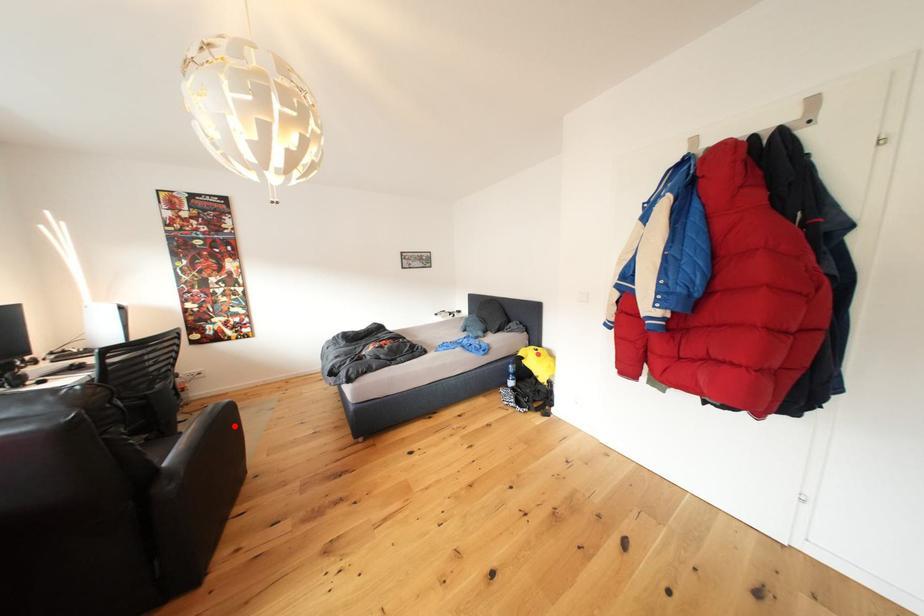
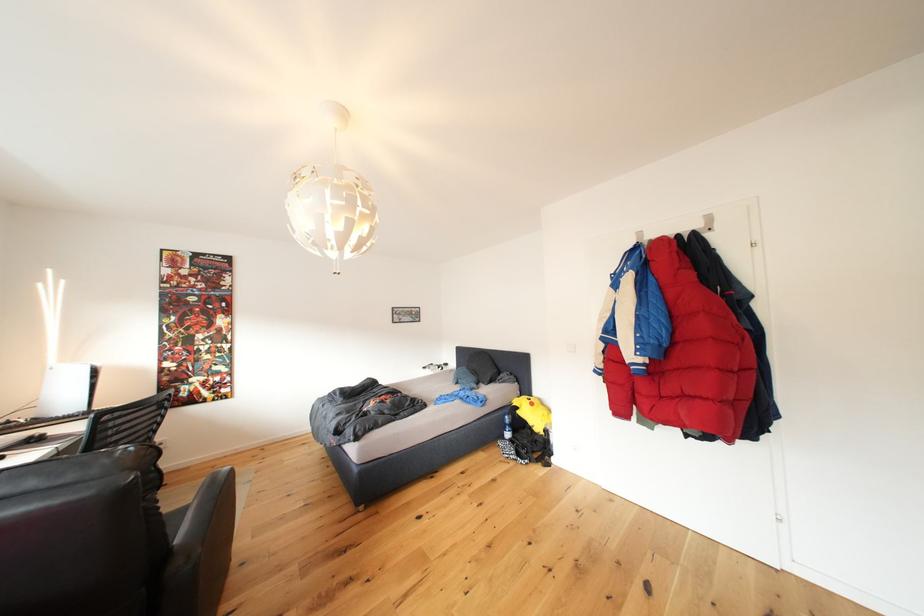
Where in the second image is the point corresponding to the highlighted location from the first image?

(229, 498)